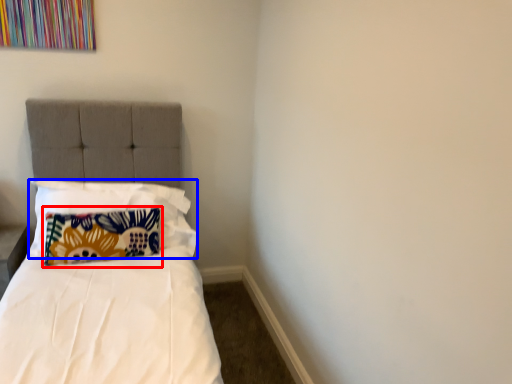
Question: Which object appears farthest to the camera in this image, pillow (highlighted by a red box) or pillow (highlighted by a blue box)?

Choices:
 (A) pillow
 (B) pillow

Answer: (A)